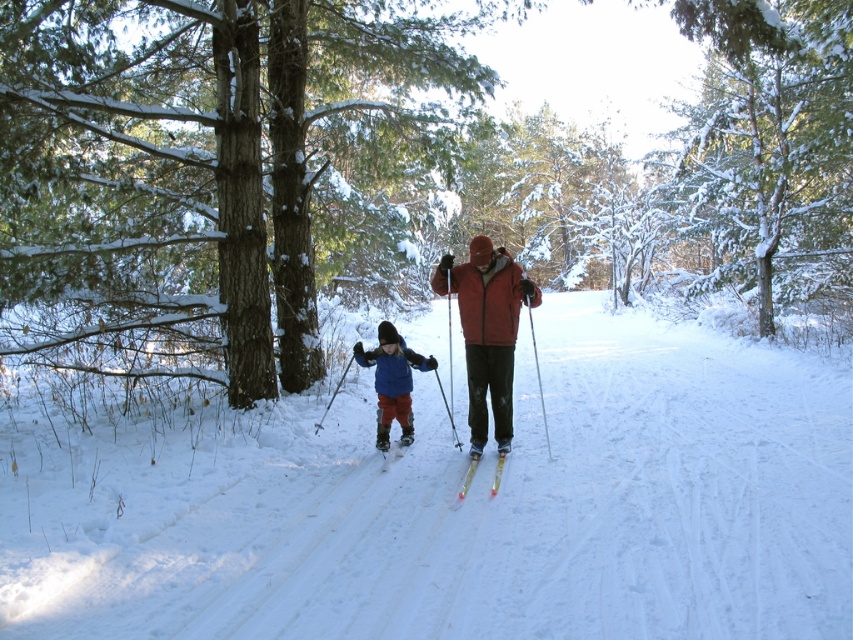
Question: Is smooth bark tree at center in front of matte black ski at lower center?

Choices:
 (A) yes
 (B) no

Answer: (A)

Question: Can you confirm if smooth bark tree at center is wider than matte black ski at lower center?

Choices:
 (A) no
 (B) yes

Answer: (B)

Question: Among these points, which one is farthest from the camera?

Choices:
 (A) (172, 269)
 (B) (405, 364)

Answer: (A)

Question: In this image, where is white powdery snow at center located relative to matte red jacket at center?

Choices:
 (A) below
 (B) above

Answer: (A)

Question: Which object is farther from the camera taking this photo?

Choices:
 (A) white powdery snow at center
 (B) blue fleece jacket at center
 (C) smooth bark tree at center
 (D) matte red jacket at center

Answer: (B)

Question: Which point is closer to the camera taking this photo?

Choices:
 (A) (637, 572)
 (B) (13, 300)

Answer: (A)